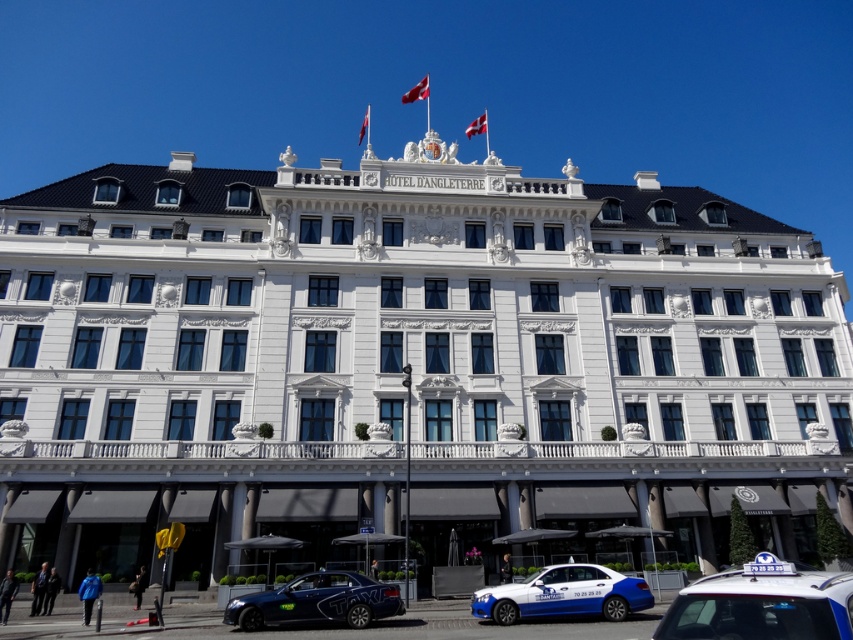
Between blue metallic taxi at lower center and shiny blue sedan at center, which one has less height?

shiny blue sedan at center is shorter.

Does blue metallic taxi at lower center have a lesser width compared to shiny blue sedan at center?

No, blue metallic taxi at lower center is not thinner than shiny blue sedan at center.

In order to click on blue metallic taxi at lower center in this screenshot , I will do `click(563, 595)`.

Which is below, white glossy taxi at lower right or shiny blue sedan at center?

shiny blue sedan at center

Is white glossy taxi at lower right behind shiny blue sedan at center?

No, white glossy taxi at lower right is closer to the viewer.

Between point (821, 627) and point (254, 605), which one is positioned behind?

Point (254, 605)

Where is `white glossy taxi at lower right`? The width and height of the screenshot is (853, 640). white glossy taxi at lower right is located at coordinates (761, 608).

Does white glossy taxi at lower right have a lesser height compared to blue metallic taxi at lower center?

Incorrect, white glossy taxi at lower right's height does not fall short of blue metallic taxi at lower center's.

Between white glossy taxi at lower right and blue metallic taxi at lower center, which one is positioned lower?

blue metallic taxi at lower center

Who is more forward, (776, 602) or (529, 608)?

Point (776, 602) is in front.

The height and width of the screenshot is (640, 853). Find the location of `white glossy taxi at lower right`. white glossy taxi at lower right is located at coordinates (761, 608).